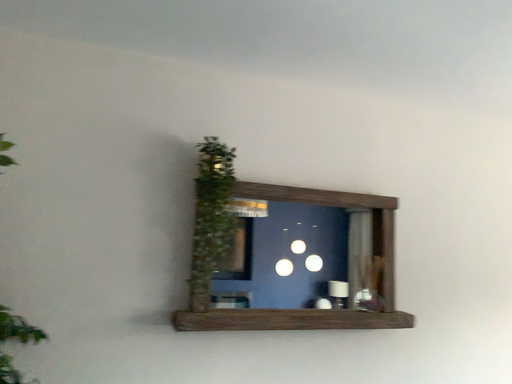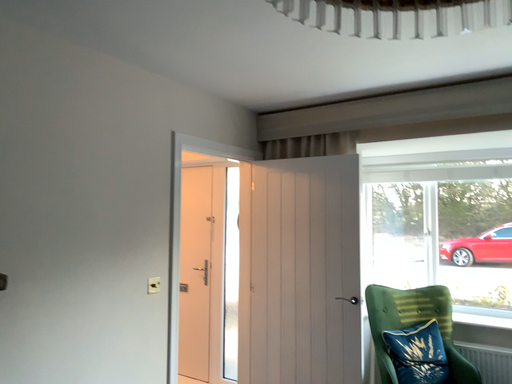
Question: Which way did the camera rotate in the video?

Choices:
 (A) rotated downward
 (B) rotated upward

Answer: (A)